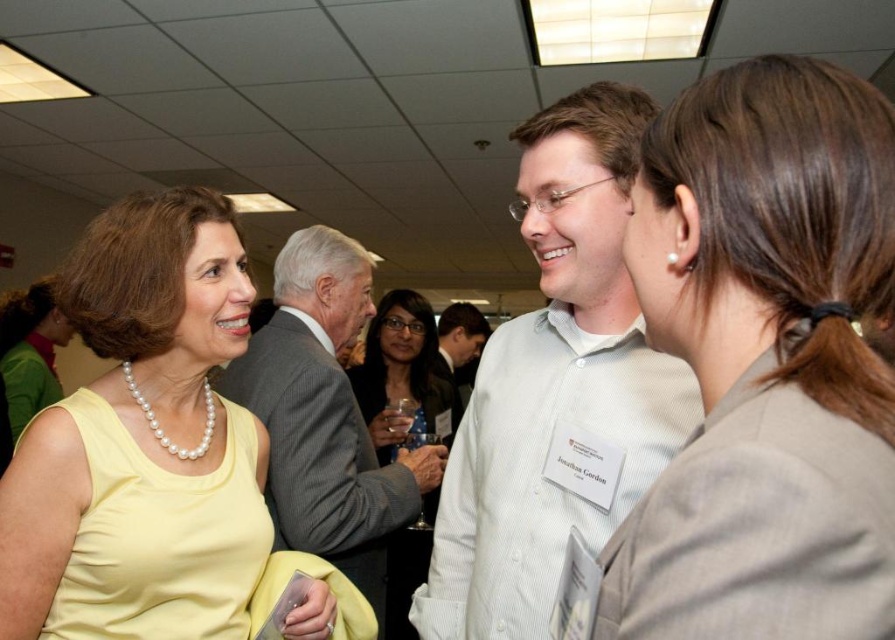
Question: Which is nearer to the brown hair at upper right?

Choices:
 (A) gray suit jacket at center
 (B) yellow fabric dress at left
 (C) matte black dress at center
 (D) white button-down shirt at center

Answer: (D)

Question: Which object is positioned closest to the gray suit jacket at center?

Choices:
 (A) brown hair at upper right
 (B) white button-down shirt at center
 (C) yellow fabric dress at left

Answer: (C)

Question: Is white button-down shirt at center bigger than yellow fabric dress at left?

Choices:
 (A) yes
 (B) no

Answer: (A)

Question: Is white button-down shirt at center to the left of yellow fabric dress at left from the viewer's perspective?

Choices:
 (A) yes
 (B) no

Answer: (B)

Question: Is yellow fabric dress at left in front of gray suit jacket at center?

Choices:
 (A) yes
 (B) no

Answer: (A)

Question: Among these points, which one is farthest from the camera?

Choices:
 (A) (701, 184)
 (B) (305, 620)

Answer: (B)